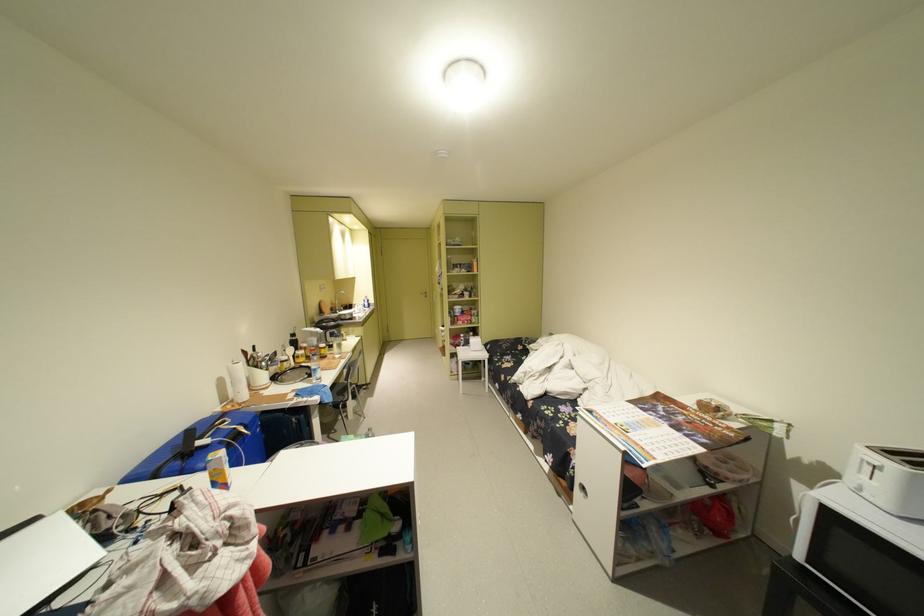
Find where to lift the water bottle. Please return your answer as a coordinate pair (x, y).

(314, 366)